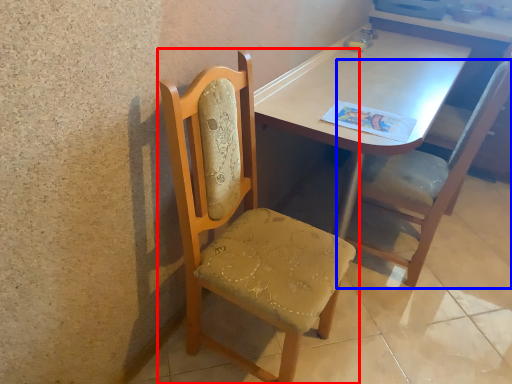
Question: Which of the following is the farthest to the observer, chair (highlighted by a red box) or chair (highlighted by a blue box)?

Choices:
 (A) chair
 (B) chair

Answer: (B)